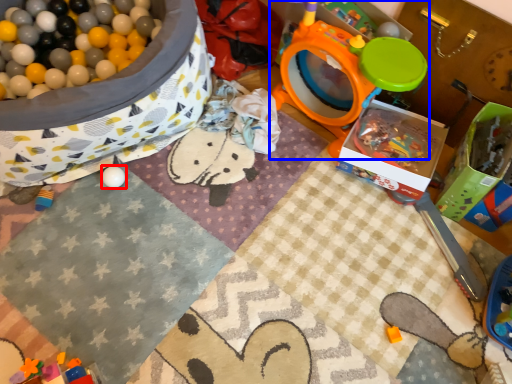
Question: Among these objects, which one is farthest to the camera, toy (highlighted by a red box) or toy (highlighted by a blue box)?

Choices:
 (A) toy
 (B) toy

Answer: (A)